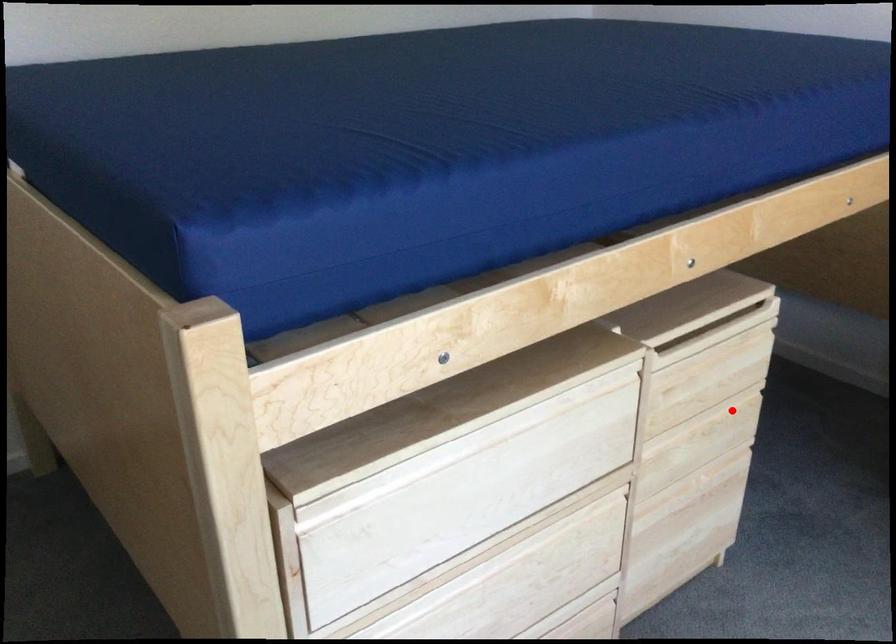
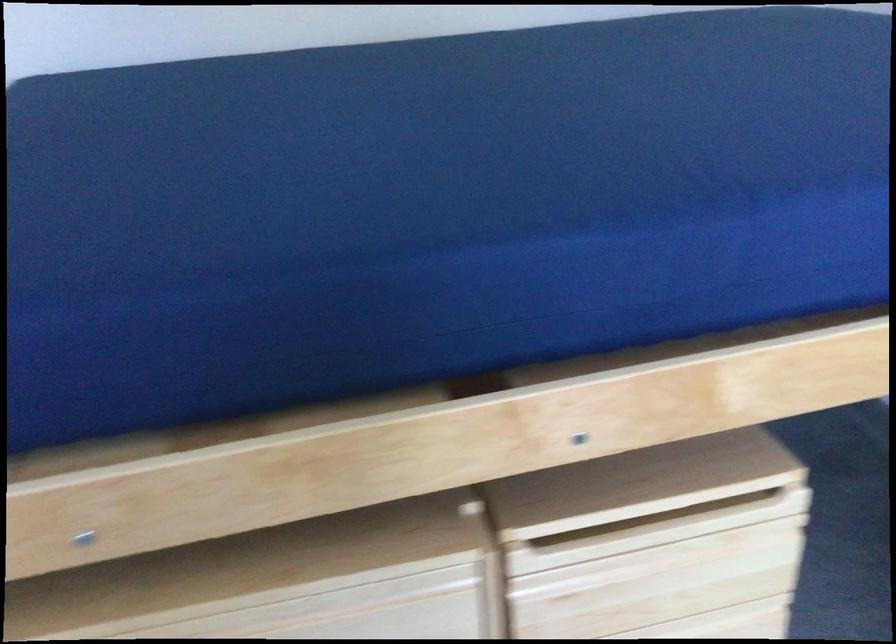
Question: I am providing you with two images of the same scene from different viewpoints. Image1 has a red point marked. In image2, the corresponding 3D location appears at what relative position? Reply with the corresponding letter.

Choices:
 (A) Closer
 (B) Farther

Answer: (A)